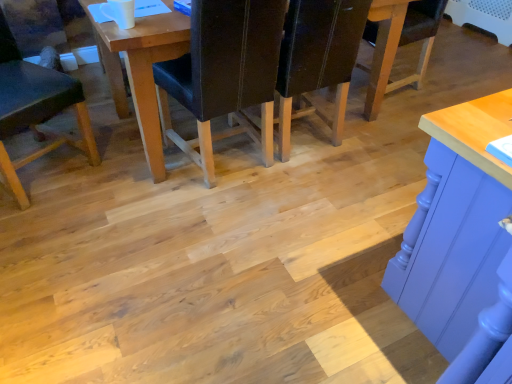
Question: Is wooden table at center aimed at dark brown leather chair at center, which is the first chair from right to left?

Choices:
 (A) yes
 (B) no

Answer: (A)

Question: From the image's perspective, does wooden table at center appear lower than dark brown leather chair at center, which appears as the third chair when viewed from the left?

Choices:
 (A) no
 (B) yes

Answer: (A)

Question: Is wooden table at center behind dark brown leather chair at center, which is the first chair from right to left?

Choices:
 (A) yes
 (B) no

Answer: (B)

Question: Would you say wooden table at center is outside dark brown leather chair at center, which appears as the third chair when viewed from the left?

Choices:
 (A) no
 (B) yes

Answer: (B)

Question: From a real-world perspective, is wooden table at center located higher than dark brown leather chair at center, which is the first chair from right to left?

Choices:
 (A) no
 (B) yes

Answer: (A)

Question: From the image's perspective, relative to wooden table at center, is black leather chair at center, arranged as the second chair when viewed from the left, above or below?

Choices:
 (A) above
 (B) below

Answer: (B)

Question: From their relative heights in the image, would you say black leather chair at center, marked as the 2th chair in a right-to-left arrangement, is taller or shorter than wooden table at center?

Choices:
 (A) tall
 (B) short

Answer: (A)

Question: Considering the positions of black leather chair at center, marked as the 2th chair in a right-to-left arrangement, and wooden table at center in the image, is black leather chair at center, marked as the 2th chair in a right-to-left arrangement, bigger or smaller than wooden table at center?

Choices:
 (A) small
 (B) big

Answer: (A)

Question: Considering the relative positions of black leather chair at center, marked as the 2th chair in a right-to-left arrangement, and wooden table at center in the image provided, is black leather chair at center, marked as the 2th chair in a right-to-left arrangement, to the left or to the right of wooden table at center?

Choices:
 (A) right
 (B) left

Answer: (B)

Question: In terms of width, does matte black chair at lower left, the first chair viewed from the left, look wider or thinner when compared to wooden table at center?

Choices:
 (A) thin
 (B) wide

Answer: (A)

Question: Considering the positions of matte black chair at lower left, the third chair in the right-to-left sequence, and wooden table at center in the image, is matte black chair at lower left, the third chair in the right-to-left sequence, taller or shorter than wooden table at center?

Choices:
 (A) tall
 (B) short

Answer: (A)

Question: Would you say matte black chair at lower left, the third chair in the right-to-left sequence, is to the left or to the right of wooden table at center in the picture?

Choices:
 (A) left
 (B) right

Answer: (A)

Question: Is point (14, 56) positioned closer to the camera than point (159, 165)?

Choices:
 (A) closer
 (B) farther

Answer: (B)

Question: In terms of size, does dark brown leather chair at center, which is the first chair from right to left, appear bigger or smaller than wooden table at center?

Choices:
 (A) big
 (B) small

Answer: (B)

Question: From a real-world perspective, relative to wooden table at center, is dark brown leather chair at center, which is the first chair from right to left, vertically above or below?

Choices:
 (A) below
 (B) above

Answer: (B)